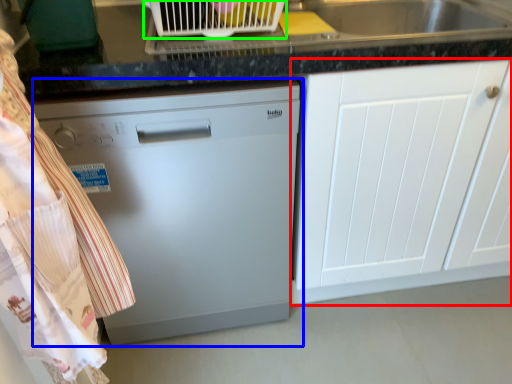
Question: Considering the real-world distances, which object is closest to cabinetry (highlighted by a red box)? home appliance (highlighted by a blue box) or appliance (highlighted by a green box).

Choices:
 (A) home appliance
 (B) appliance

Answer: (A)